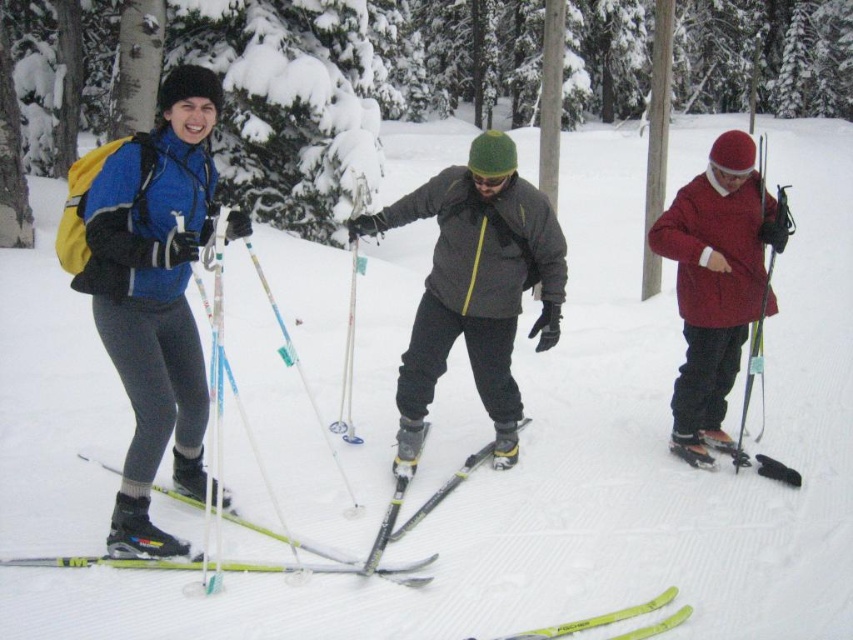
Is matte blue jacket at left to the right of yellow matte skis at lower center from the viewer's perspective?

No, matte blue jacket at left is not to the right of yellow matte skis at lower center.

The image size is (853, 640). I want to click on matte blue jacket at left, so pyautogui.click(x=149, y=289).

Between matte red jacket at center and yellow matte skis at lower center, which one has more height?

Standing taller between the two is matte red jacket at center.

Does matte red jacket at center come in front of yellow matte skis at lower center?

No.

Who is more distant from viewer, [734,177] or [636,609]?

The point [734,177] is behind.

This screenshot has width=853, height=640. Find the location of `matte red jacket at center`. matte red jacket at center is located at coordinates (717, 284).

Between shiny black ski at center and yellow matte skis at lower center, which one has less height?

Standing shorter between the two is yellow matte skis at lower center.

Between point (447, 486) and point (633, 612), which one is positioned in front?

Point (633, 612) is more forward.

Who is more forward, (492, 451) or (640, 612)?

Positioned in front is point (640, 612).

Locate an element on the screen. Image resolution: width=853 pixels, height=640 pixels. shiny black ski at center is located at coordinates (418, 508).